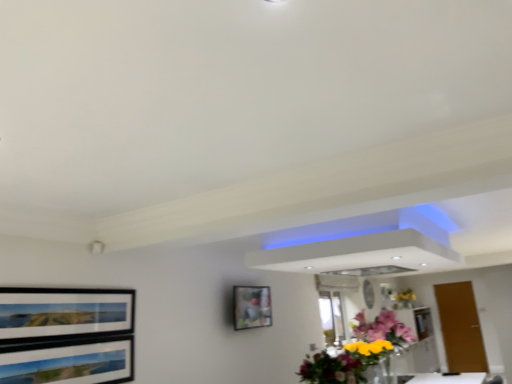
Question: Considering the relative sizes of translucent glass vase at upper right, which is the second flower from top to bottom, and vibrant floral bouquet at center, acting as the second flower starting from the bottom, in the image provided, is translucent glass vase at upper right, which is the second flower from top to bottom, thinner than vibrant floral bouquet at center, acting as the second flower starting from the bottom,?

Choices:
 (A) no
 (B) yes

Answer: (B)

Question: Is vibrant floral bouquet at center, the first flower in the top-to-bottom sequence, a part of translucent glass vase at upper right, which ranks as the 1th flower in back-to-front order?

Choices:
 (A) yes
 (B) no

Answer: (B)

Question: Does translucent glass vase at upper right, positioned as the 2th flower in left-to-right order, come in front of vibrant floral bouquet at center, the 2th flower from the back?

Choices:
 (A) no
 (B) yes

Answer: (A)

Question: Is translucent glass vase at upper right, the 1th flower from the right, smaller than vibrant floral bouquet at center, the second flower in the right-to-left sequence?

Choices:
 (A) yes
 (B) no

Answer: (A)

Question: Is translucent glass vase at upper right, the 1th flower in the bottom-to-top sequence, further to the viewer compared to vibrant floral bouquet at center, the second flower in the right-to-left sequence?

Choices:
 (A) yes
 (B) no

Answer: (A)

Question: Is translucent glass vase at upper right, the 1th flower from the right, bigger than vibrant floral bouquet at center, the first flower in the top-to-bottom sequence?

Choices:
 (A) no
 (B) yes

Answer: (A)

Question: Considering the relative sizes of brown matte door at right and glossy floral bouquet at center in the image provided, is brown matte door at right thinner than glossy floral bouquet at center?

Choices:
 (A) no
 (B) yes

Answer: (B)

Question: From a real-world perspective, is brown matte door at right beneath glossy floral bouquet at center?

Choices:
 (A) no
 (B) yes

Answer: (B)

Question: Is the depth of brown matte door at right greater than that of glossy floral bouquet at center?

Choices:
 (A) no
 (B) yes

Answer: (B)

Question: Is glossy floral bouquet at center completely or partially inside brown matte door at right?

Choices:
 (A) yes
 (B) no

Answer: (B)

Question: Is brown matte door at right not near glossy floral bouquet at center?

Choices:
 (A) no
 (B) yes

Answer: (B)

Question: From a real-world perspective, is brown matte door at right positioned over glossy floral bouquet at center based on gravity?

Choices:
 (A) yes
 (B) no

Answer: (B)

Question: Is brown matte door at right oriented away from translucent glass vase at upper right, which is the second flower from top to bottom?

Choices:
 (A) yes
 (B) no

Answer: (B)